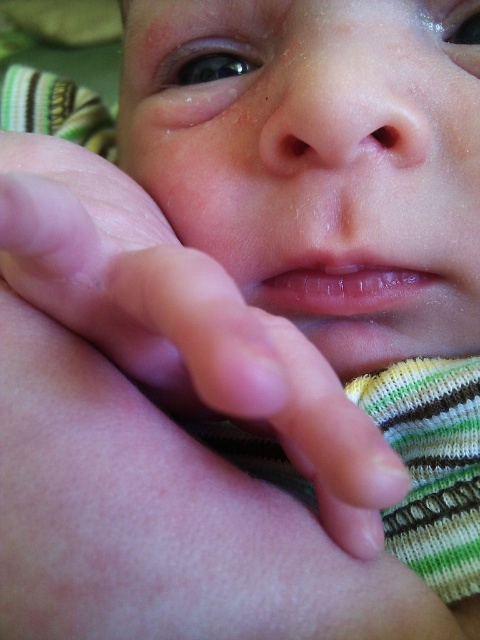
Locate an element on the screen. smooth skin baby at center is located at coordinates (319, 161).

Does point (420, 188) lie behind point (193, 317)?

Yes, point (420, 188) is farther from viewer.

Is point (407, 28) positioned after point (12, 241)?

Yes.

This screenshot has width=480, height=640. What are the coordinates of `smooth skin baby at center` in the screenshot? It's located at (319, 161).